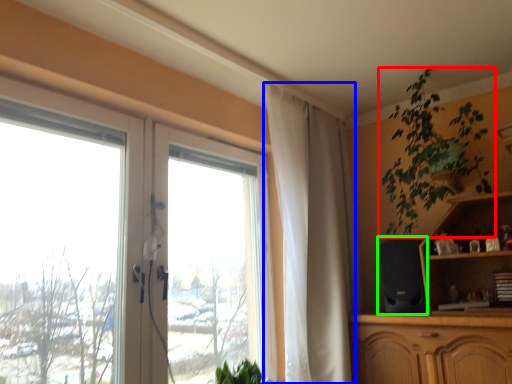
Question: Based on their relative distances, which object is nearer to houseplant (highlighted by a red box)? Choose from curtain (highlighted by a blue box) and speaker (highlighted by a green box).

Choices:
 (A) curtain
 (B) speaker

Answer: (B)